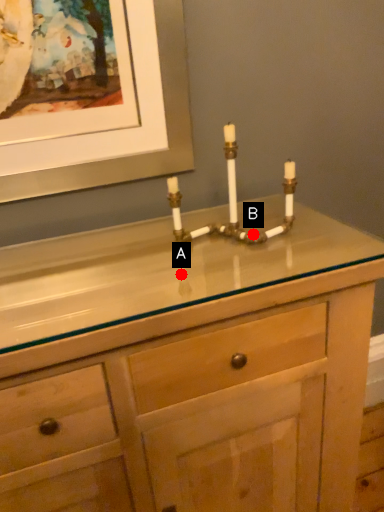
Question: Two points are circled on the image, labeled by A and B beside each circle. Which point is farther from the camera taking this photo?

Choices:
 (A) A is further
 (B) B is further

Answer: (B)